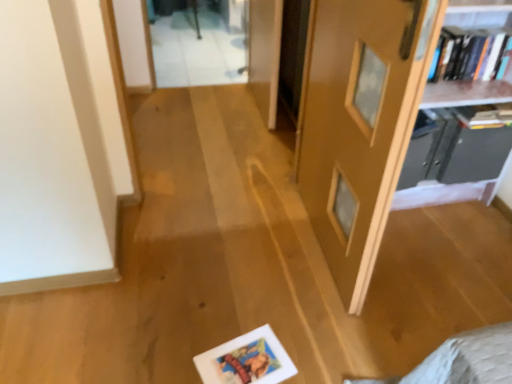
Question: Is transparent glass door at upper center positioned with its back to hardcover books at upper right, which ranks as the 1th book in top-to-bottom order?

Choices:
 (A) no
 (B) yes

Answer: (A)

Question: Is transparent glass door at upper center taller than hardcover books at upper right, which ranks as the 1th book in top-to-bottom order?

Choices:
 (A) yes
 (B) no

Answer: (B)

Question: Is there a large distance between transparent glass door at upper center and hardcover books at upper right, which ranks as the 1th book in top-to-bottom order?

Choices:
 (A) no
 (B) yes

Answer: (B)

Question: Is the position of transparent glass door at upper center less distant than that of hardcover books at upper right, which ranks as the 1th book in top-to-bottom order?

Choices:
 (A) no
 (B) yes

Answer: (A)

Question: From a real-world perspective, is transparent glass door at upper center on top of hardcover books at upper right, which is the second book from bottom to top?

Choices:
 (A) no
 (B) yes

Answer: (A)

Question: Can you confirm if transparent glass door at upper center is shorter than hardcover books at upper right, which ranks as the 1th book in top-to-bottom order?

Choices:
 (A) yes
 (B) no

Answer: (A)

Question: Can you confirm if white matte picture frame at lower center is bigger than wooden bookshelf at upper right, arranged as the first shelf when viewed from the top?

Choices:
 (A) no
 (B) yes

Answer: (A)

Question: From a real-world perspective, is white matte picture frame at lower center on top of wooden bookshelf at upper right, which appears as the 2th shelf when ordered from the bottom?

Choices:
 (A) yes
 (B) no

Answer: (B)

Question: Considering the relative sizes of white matte picture frame at lower center and wooden bookshelf at upper right, which appears as the 2th shelf when ordered from the bottom, in the image provided, is white matte picture frame at lower center wider than wooden bookshelf at upper right, which appears as the 2th shelf when ordered from the bottom,?

Choices:
 (A) no
 (B) yes

Answer: (A)

Question: Could wooden bookshelf at upper right, which appears as the 2th shelf when ordered from the bottom, be considered to be inside white matte picture frame at lower center?

Choices:
 (A) yes
 (B) no

Answer: (B)

Question: Is white matte picture frame at lower center not close to wooden bookshelf at upper right, arranged as the first shelf when viewed from the top?

Choices:
 (A) no
 (B) yes

Answer: (B)

Question: Does white matte picture frame at lower center appear on the right side of wooden bookshelf at upper right, arranged as the first shelf when viewed from the top?

Choices:
 (A) no
 (B) yes

Answer: (A)

Question: From the image's perspective, is white matte picture frame at lower center beneath matte wooden door at center?

Choices:
 (A) no
 (B) yes

Answer: (B)